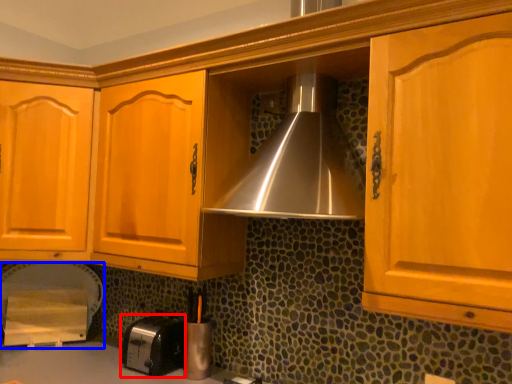
Question: Which object is further to the camera taking this photo, toaster (highlighted by a red box) or appliance (highlighted by a blue box)?

Choices:
 (A) toaster
 (B) appliance

Answer: (B)